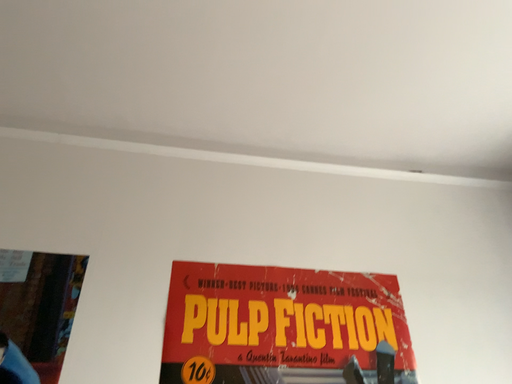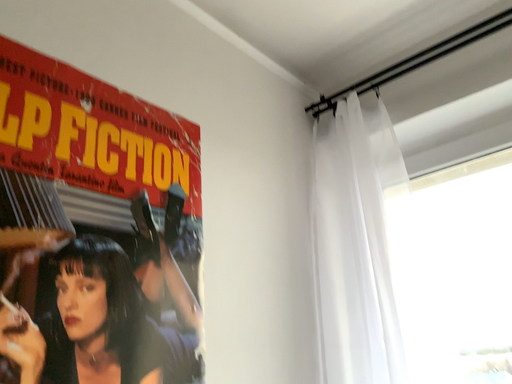
Question: How did the camera likely rotate when shooting the video?

Choices:
 (A) rotated upward
 (B) rotated downward

Answer: (B)